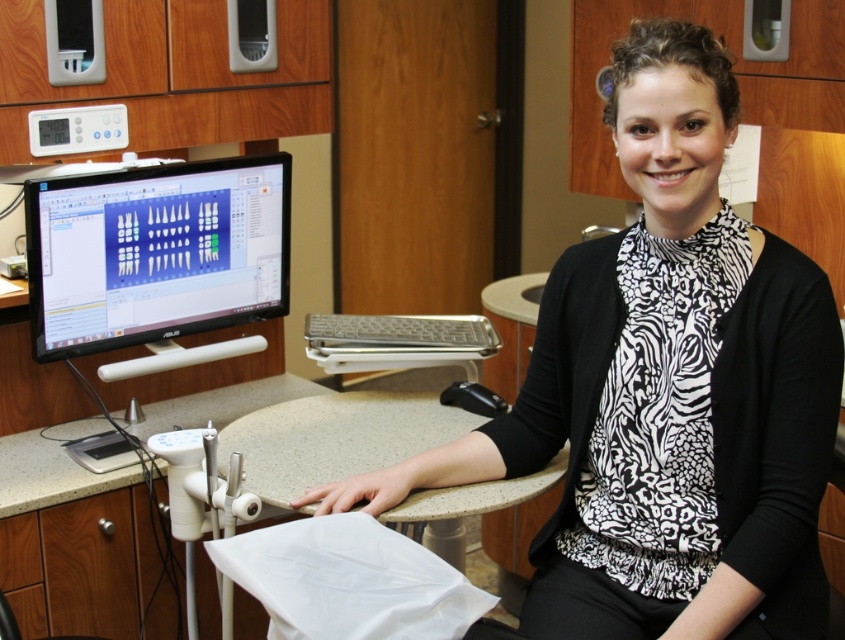
Question: Does matte black monitor at center appear on the left side of white laminate counter at lower center?

Choices:
 (A) yes
 (B) no

Answer: (B)

Question: Which point is closer to the camera?

Choices:
 (A) (36, 483)
 (B) (726, 420)
 (C) (206, 244)

Answer: (B)

Question: Is matte black monitor at center to the right of white laminate counter at lower center from the viewer's perspective?

Choices:
 (A) no
 (B) yes

Answer: (B)

Question: Which of the following is the closest to the observer?

Choices:
 (A) (609, 518)
 (B) (36, 317)
 (C) (217, 422)

Answer: (A)

Question: Among these objects, which one is farthest from the camera?

Choices:
 (A) matte black monitor at center
 (B) white laminate counter at lower center

Answer: (A)

Question: Is matte black monitor at center bigger than white laminate counter at lower center?

Choices:
 (A) no
 (B) yes

Answer: (A)